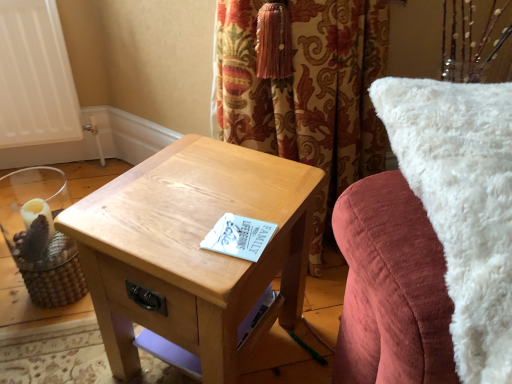
Question: From a real-world perspective, is white fluffy pillow at upper right located higher than woven wood candle holder at left?

Choices:
 (A) no
 (B) yes

Answer: (B)

Question: Is white fluffy pillow at upper right completely or partially outside of woven wood candle holder at left?

Choices:
 (A) no
 (B) yes

Answer: (B)

Question: Does white fluffy pillow at upper right have a greater width compared to woven wood candle holder at left?

Choices:
 (A) yes
 (B) no

Answer: (A)

Question: From the image's perspective, is white fluffy pillow at upper right on top of woven wood candle holder at left?

Choices:
 (A) yes
 (B) no

Answer: (A)

Question: Is white fluffy pillow at upper right beside woven wood candle holder at left?

Choices:
 (A) yes
 (B) no

Answer: (B)

Question: From the image's perspective, is woven wood candle holder at left positioned above or below white fluffy pillow at upper right?

Choices:
 (A) below
 (B) above

Answer: (A)

Question: In the image, is woven wood candle holder at left positioned in front of or behind white fluffy pillow at upper right?

Choices:
 (A) front
 (B) behind

Answer: (B)

Question: Based on their positions, is woven wood candle holder at left located to the left or right of white fluffy pillow at upper right?

Choices:
 (A) left
 (B) right

Answer: (A)

Question: Is point (71, 279) closer or farther from the camera than point (481, 119)?

Choices:
 (A) closer
 (B) farther

Answer: (B)

Question: Is light brown wood table at center to the left or to the right of white fluffy pillow at upper right in the image?

Choices:
 (A) left
 (B) right

Answer: (A)

Question: From the image's perspective, is light brown wood table at center located above or below white fluffy pillow at upper right?

Choices:
 (A) below
 (B) above

Answer: (A)

Question: Is light brown wood table at center in front of or behind white fluffy pillow at upper right in the image?

Choices:
 (A) front
 (B) behind

Answer: (B)

Question: Is light brown wood table at center spatially inside white fluffy pillow at upper right, or outside of it?

Choices:
 (A) inside
 (B) outside

Answer: (B)

Question: Is white fluffy pillow at upper right wider or thinner than light brown wood table at center?

Choices:
 (A) wide
 (B) thin

Answer: (A)

Question: From a real-world perspective, relative to light brown wood table at center, is white fluffy pillow at upper right vertically above or below?

Choices:
 (A) below
 (B) above

Answer: (B)